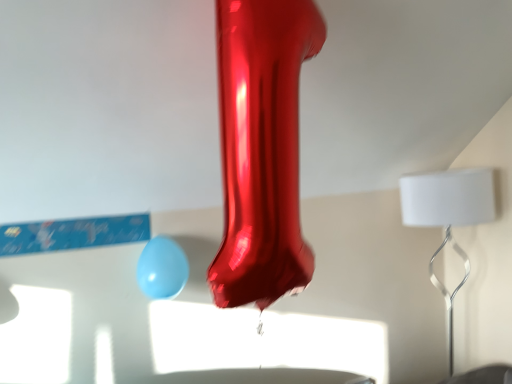
Question: Can you confirm if white matte lampshade at right is wider than matte blue balloon at lower center?

Choices:
 (A) no
 (B) yes

Answer: (B)

Question: Considering the relative positions of white matte lampshade at right and matte blue balloon at lower center in the image provided, is white matte lampshade at right to the left of matte blue balloon at lower center from the viewer's perspective?

Choices:
 (A) no
 (B) yes

Answer: (A)

Question: Could matte blue balloon at lower center be considered to be inside white matte lampshade at right?

Choices:
 (A) no
 (B) yes

Answer: (A)

Question: Considering the relative sizes of white matte lampshade at right and matte blue balloon at lower center in the image provided, is white matte lampshade at right shorter than matte blue balloon at lower center?

Choices:
 (A) no
 (B) yes

Answer: (A)

Question: From a real-world perspective, is white matte lampshade at right beneath matte blue balloon at lower center?

Choices:
 (A) no
 (B) yes

Answer: (B)

Question: Considering the relative sizes of white matte lampshade at right and matte blue balloon at lower center in the image provided, is white matte lampshade at right bigger than matte blue balloon at lower center?

Choices:
 (A) no
 (B) yes

Answer: (B)

Question: Can you confirm if matte blue balloon at lower center is positioned to the right of white matte lampshade at right?

Choices:
 (A) yes
 (B) no

Answer: (B)

Question: From a real-world perspective, is matte blue balloon at lower center on white matte lampshade at right?

Choices:
 (A) no
 (B) yes

Answer: (B)

Question: Is matte blue balloon at lower center further to the viewer compared to white matte lampshade at right?

Choices:
 (A) no
 (B) yes

Answer: (A)

Question: Is matte blue balloon at lower center facing towards white matte lampshade at right?

Choices:
 (A) no
 (B) yes

Answer: (A)

Question: Can you confirm if matte blue balloon at lower center is wider than white matte lampshade at right?

Choices:
 (A) yes
 (B) no

Answer: (B)

Question: Is matte blue balloon at lower center to the left of white matte lampshade at right from the viewer's perspective?

Choices:
 (A) no
 (B) yes

Answer: (B)

Question: Is matte blue balloon at lower center wider or thinner than white matte lampshade at right?

Choices:
 (A) wide
 (B) thin

Answer: (B)